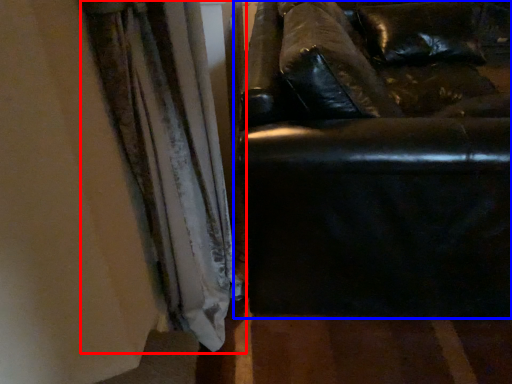
Question: Which point is further to the camera, curtain (highlighted by a red box) or studio couch (highlighted by a blue box)?

Choices:
 (A) curtain
 (B) studio couch

Answer: (B)